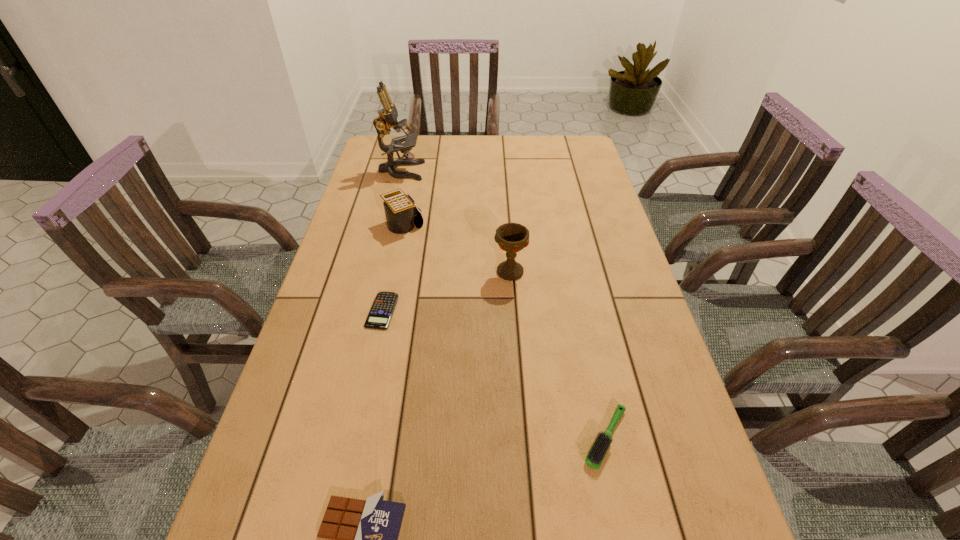
At what (x,y) coordinates should I click in order to perform the action: click on vacant space at the left edge. Please return your answer as a coordinate pair (x, y). This screenshot has height=540, width=960. Looking at the image, I should click on (355, 333).

You are a GUI agent. You are given a task and a screenshot of the screen. Output one action in this format:
    pyautogui.click(x=<x>, y=<y>)
    Task: Click on the vacant space at the right edge
    
    Given the screenshot: What is the action you would take?
    pyautogui.click(x=559, y=177)

Identify the location of blank space at the far right corner. This screenshot has height=540, width=960. tap(564, 138).

At what (x,y) coordinates should I click in order to perform the action: click on free space between the rightmost object and the farther calculator. Please return your answer as a coordinate pair (x, y). Image resolution: width=960 pixels, height=540 pixels. Looking at the image, I should click on (504, 332).

Locate an element on the screen. The image size is (960, 540). unoccupied area between the microscope and the shortest object is located at coordinates (392, 241).

Locate an element on the screen. free space between the microscope and the fourth tallest object is located at coordinates (503, 305).

This screenshot has height=540, width=960. What are the coordinates of `vacant space that is in between the farthest object and the fourth tallest object` in the screenshot? It's located at (503, 305).

In order to click on free space that is in between the tallest object and the third farthest object in this screenshot , I will do `click(455, 221)`.

Where is `free spot between the rightmost object and the microscope`? The image size is (960, 540). free spot between the rightmost object and the microscope is located at coordinates (503, 305).

Locate an element on the screen. object that is the second closest to the fifth tallest object is located at coordinates (381, 312).